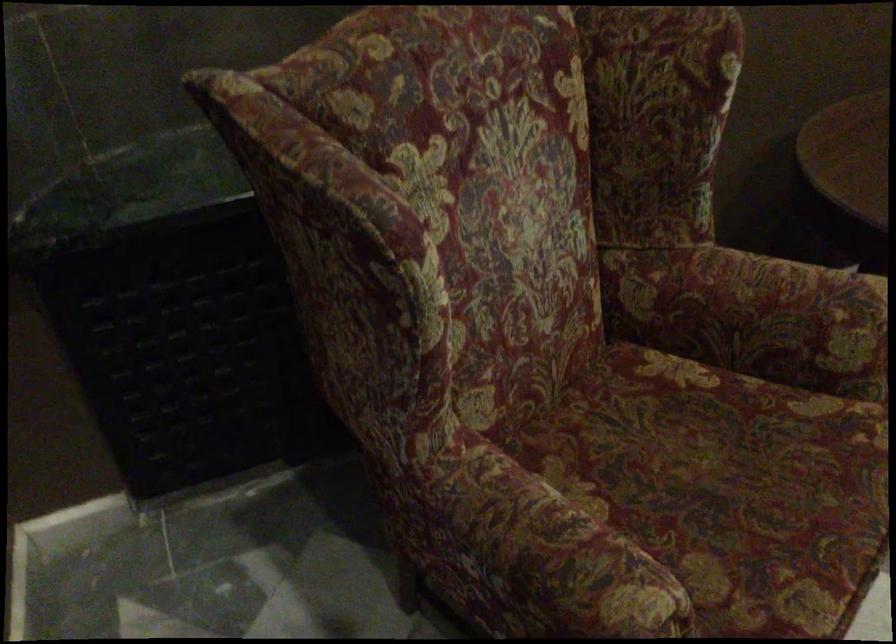
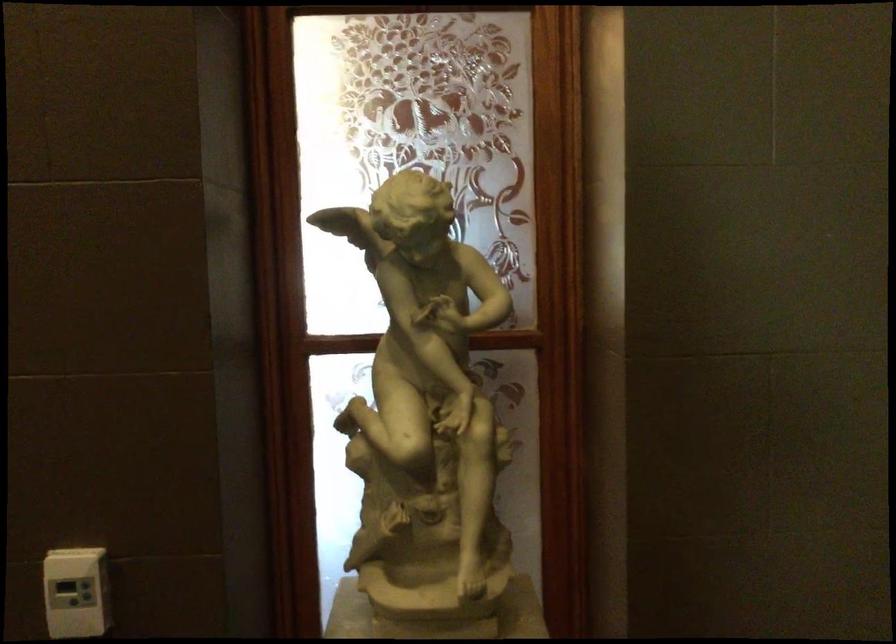
First-person continuous shooting, in which direction is the camera rotating?

The camera's rotation is toward left-down.